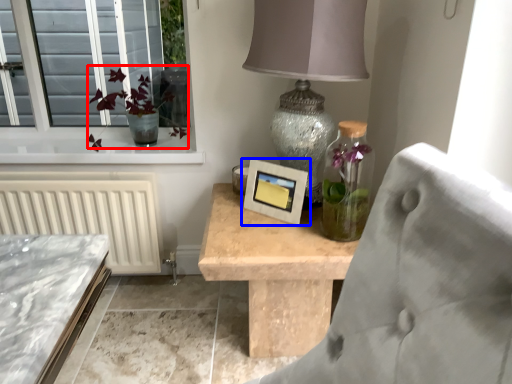
Question: Which of the following is the closest to the observer, floral arrangement (highlighted by a red box) or picture frame (highlighted by a blue box)?

Choices:
 (A) floral arrangement
 (B) picture frame

Answer: (B)